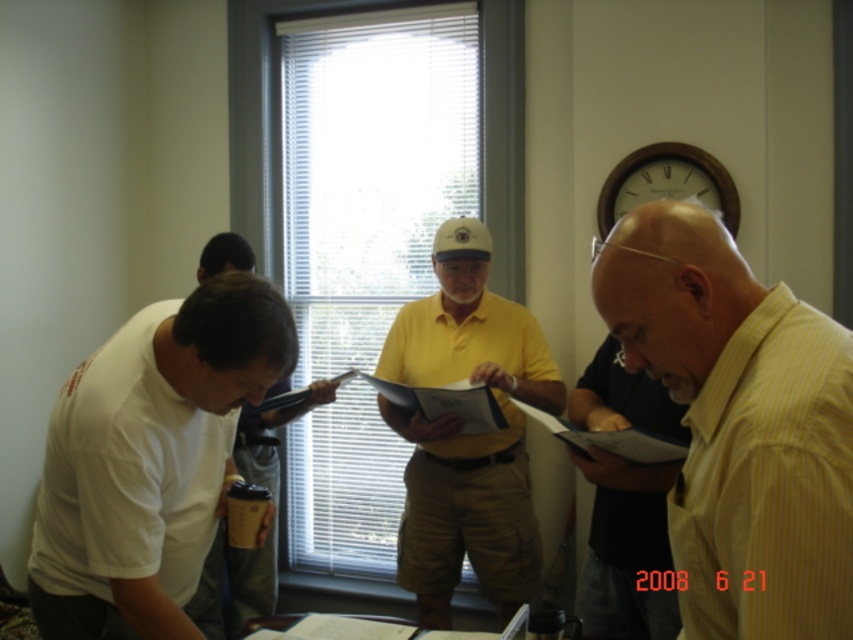
Is point (200, 256) positioned after point (682, 192)?

Yes.

Can you confirm if white matte shirt at lower left is positioned to the right of wooden clock at upper center?

Incorrect, white matte shirt at lower left is not on the right side of wooden clock at upper center.

Is point (273, 604) less distant than point (602, 204)?

No.

Where is `white matte shirt at lower left`? The image size is (853, 640). white matte shirt at lower left is located at coordinates (234, 584).

Does point (579, 605) come in front of point (224, 624)?

Yes.

Between light brown striped shirt at right and white matte shirt at lower left, which one is positioned higher?

light brown striped shirt at right

Locate an element on the screen. This screenshot has width=853, height=640. light brown striped shirt at right is located at coordinates (627, 552).

Does point (129, 346) come closer to viewer compared to point (223, 566)?

Yes, point (129, 346) is closer to viewer.

Is the position of white matte t-shirt at left less distant than that of white matte shirt at lower left?

Yes, white matte t-shirt at left is in front of white matte shirt at lower left.

Who is more distant from viewer, (219,396) or (273,477)?

The point (273,477) is more distant.

What are the coordinates of `white matte t-shirt at left` in the screenshot? It's located at (149, 460).